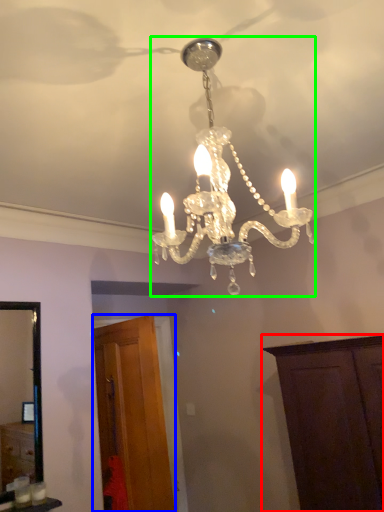
Question: Considering the real-world distances, which object is closest to cabinetry (highlighted by a red box)? cabinetry (highlighted by a blue box) or lamp (highlighted by a green box).

Choices:
 (A) cabinetry
 (B) lamp

Answer: (A)